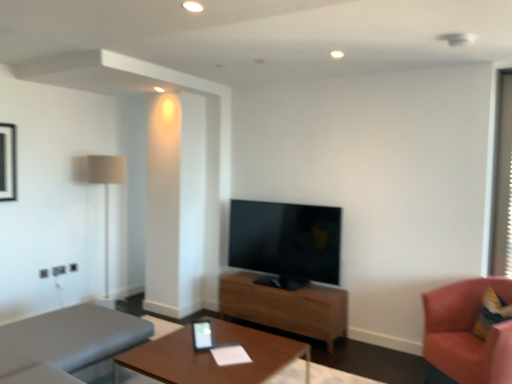
Question: Is black glossy picture frame at upper left positioned with its back to gray fabric studio couch at lower left?

Choices:
 (A) no
 (B) yes

Answer: (A)

Question: From the image's perspective, is black glossy picture frame at upper left on gray fabric studio couch at lower left?

Choices:
 (A) yes
 (B) no

Answer: (A)

Question: Can you confirm if black glossy picture frame at upper left is shorter than gray fabric studio couch at lower left?

Choices:
 (A) no
 (B) yes

Answer: (B)

Question: Does black glossy picture frame at upper left have a smaller size compared to gray fabric studio couch at lower left?

Choices:
 (A) yes
 (B) no

Answer: (A)

Question: Is black glossy picture frame at upper left far away from gray fabric studio couch at lower left?

Choices:
 (A) yes
 (B) no

Answer: (A)

Question: In the image, is wooden table at center, the second table in the front-to-back sequence, positioned in front of or behind black glossy picture frame at upper left?

Choices:
 (A) behind
 (B) front

Answer: (B)

Question: Is point (309, 292) positioned closer to the camera than point (10, 137)?

Choices:
 (A) closer
 (B) farther

Answer: (A)

Question: In terms of width, does wooden table at center, the second table in the front-to-back sequence, look wider or thinner when compared to black glossy picture frame at upper left?

Choices:
 (A) thin
 (B) wide

Answer: (B)

Question: Considering the positions of wooden table at center, which appears as the 1th table when viewed from the back, and black glossy picture frame at upper left in the image, is wooden table at center, which appears as the 1th table when viewed from the back, bigger or smaller than black glossy picture frame at upper left?

Choices:
 (A) small
 (B) big

Answer: (B)

Question: Considering the positions of point (468, 369) and point (495, 193), is point (468, 369) closer or farther from the camera than point (495, 193)?

Choices:
 (A) farther
 (B) closer

Answer: (B)

Question: Looking at their shapes, would you say pink fabric chair at right is wider or thinner than transparent plastic window screen at right?

Choices:
 (A) thin
 (B) wide

Answer: (B)

Question: Would you say pink fabric chair at right is inside or outside transparent plastic window screen at right?

Choices:
 (A) outside
 (B) inside

Answer: (A)

Question: Considering their positions, is pink fabric chair at right located in front of or behind transparent plastic window screen at right?

Choices:
 (A) behind
 (B) front

Answer: (B)

Question: From their relative heights in the image, would you say wooden table at center, which appears as the 1th table when viewed from the back, is taller or shorter than pink fabric chair at right?

Choices:
 (A) short
 (B) tall

Answer: (A)

Question: Is wooden table at center, which appears as the 1th table when viewed from the back, in front of or behind pink fabric chair at right in the image?

Choices:
 (A) front
 (B) behind

Answer: (B)